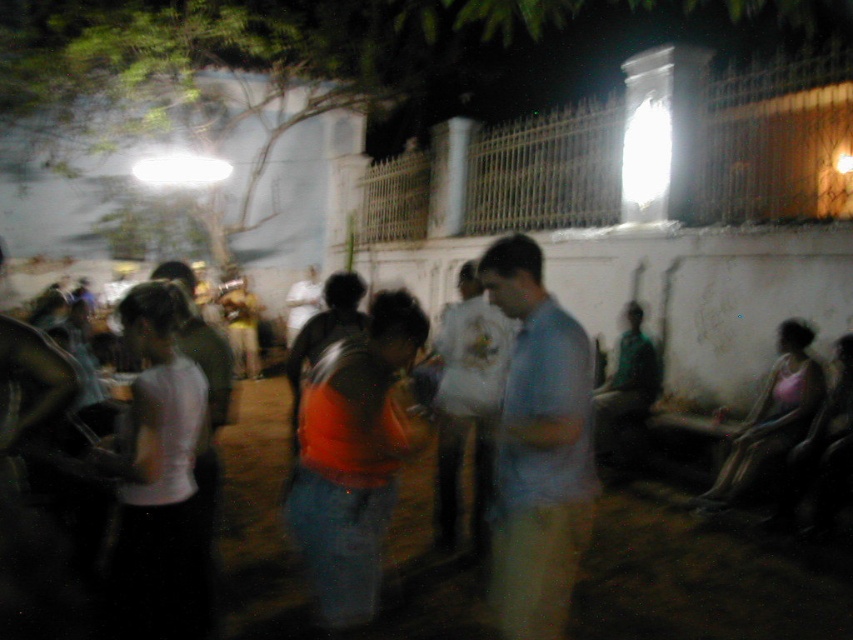
Looking at this image, you are at an outdoor event and see two people wearing shirts of different colors. The orange fabric shirt at center and the light blue fabric shirt at center. Which one is more to the right?

The orange fabric shirt at center is positioned on the right side of light blue fabric shirt at center, so the orange fabric shirt at center is more to the right.

You are a photographer trying to capture a clear photo of the white matte bag at center. However, the light blue fabric shirt at center is blocking your view. Can you move the bag to the side to get a clear shot?

The light blue fabric shirt at center is in front of the white matte bag at center, so you cannot move the bag to the side to get a clear shot without adjusting the position of the shirt or moving around the obstruction.

You are using a camera with a 100mm lens and want to focus on the orange fabric shirt at center. Since the camera was handheld during the shot, what is the minimum shutter speed you should use to avoid motion blur? Assume the crop factor is 1.5 and follow the reciprocal rule.

According to the reciprocal rule, the minimum shutter speed should be 1 divided by the effective focal length. The effective focal length is 100mm multiplied by the crop factor of 1.5, resulting in 150mm. Therefore, the minimum shutter speed required is 1 over 150 seconds, or 1.500 shutter speed. This helps minimize motion blur when handholding the camera while focusing on the orange fabric shirt at center.